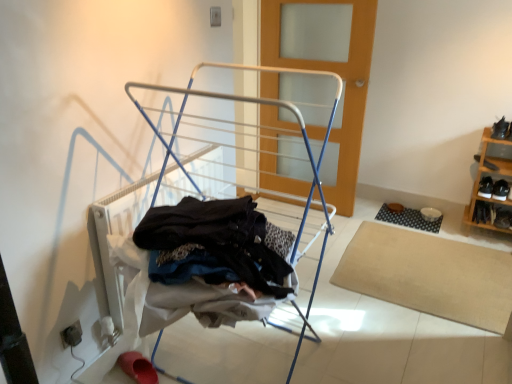
You are a GUI agent. You are given a task and a screenshot of the screen. Output one action in this format:
    pyautogui.click(x=<x>, y=<y>)
    Task: Click on the free space below black rubber mat at lower right, the first mat when ordered from top to bottom (from a real-world perspective)
    
    Given the screenshot: What is the action you would take?
    pos(404,213)